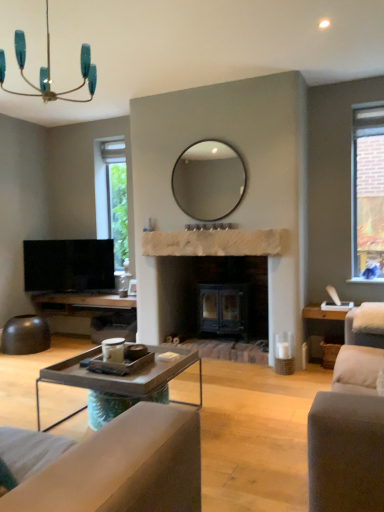
Question: Does teal glass chandelier at upper left have a larger size compared to metallic gray coffee table at lower center?

Choices:
 (A) no
 (B) yes

Answer: (A)

Question: Is teal glass chandelier at upper left not inside metallic gray coffee table at lower center?

Choices:
 (A) yes
 (B) no

Answer: (A)

Question: From a real-world perspective, is teal glass chandelier at upper left beneath metallic gray coffee table at lower center?

Choices:
 (A) yes
 (B) no

Answer: (B)

Question: Does teal glass chandelier at upper left turn towards metallic gray coffee table at lower center?

Choices:
 (A) yes
 (B) no

Answer: (B)

Question: From the image's perspective, is teal glass chandelier at upper left located above metallic gray coffee table at lower center?

Choices:
 (A) no
 (B) yes

Answer: (B)

Question: Is teal glass chandelier at upper left to the right of metallic gray coffee table at lower center from the viewer's perspective?

Choices:
 (A) yes
 (B) no

Answer: (B)

Question: From a real-world perspective, does flat screen tv at left stand above metallic gray coffee table at lower center?

Choices:
 (A) yes
 (B) no

Answer: (A)

Question: Is flat screen tv at left taller than metallic gray coffee table at lower center?

Choices:
 (A) yes
 (B) no

Answer: (A)

Question: Does flat screen tv at left turn towards metallic gray coffee table at lower center?

Choices:
 (A) yes
 (B) no

Answer: (A)

Question: Is flat screen tv at left behind metallic gray coffee table at lower center?

Choices:
 (A) yes
 (B) no

Answer: (A)

Question: From the image's perspective, is flat screen tv at left located beneath metallic gray coffee table at lower center?

Choices:
 (A) yes
 (B) no

Answer: (B)

Question: Considering the relative sizes of flat screen tv at left and metallic gray coffee table at lower center in the image provided, is flat screen tv at left thinner than metallic gray coffee table at lower center?

Choices:
 (A) no
 (B) yes

Answer: (B)

Question: Would you say white fabric swivel chair at right is part of matte glass mirror at center's contents?

Choices:
 (A) yes
 (B) no

Answer: (B)